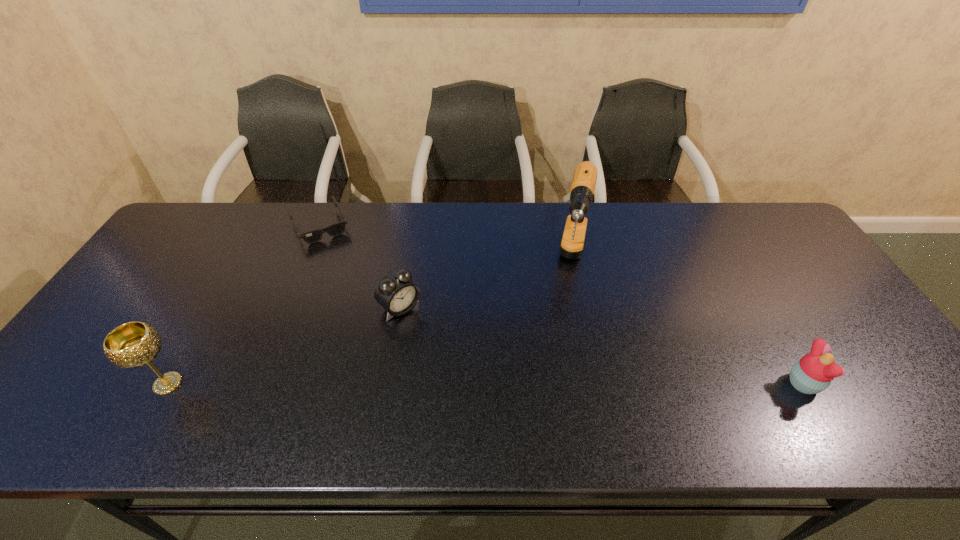
Locate an element on the screen. The height and width of the screenshot is (540, 960). vacant space on the desktop that is between the leftmost object and the rightmost object and is positioned on the front side of the alarm clock is located at coordinates (487, 384).

Locate an element on the screen. free space on the desktop that is between the leftmost object and the cupcake and is positioned on the temples of the shortest object is located at coordinates (393, 384).

Find the location of `vacant space on the desktop that is between the chalice and the rightmost object and is positioned at the tip of the tallest object`. vacant space on the desktop that is between the chalice and the rightmost object and is positioned at the tip of the tallest object is located at coordinates (549, 384).